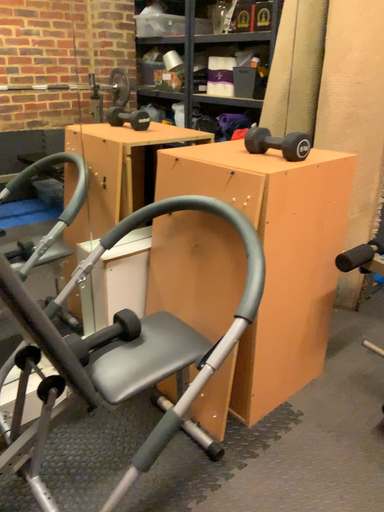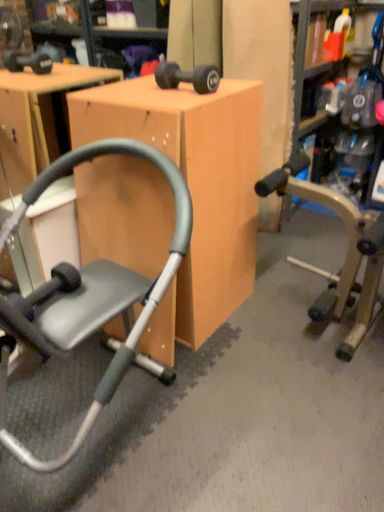
Question: Which way did the camera rotate in the video?

Choices:
 (A) rotated left
 (B) rotated right

Answer: (B)